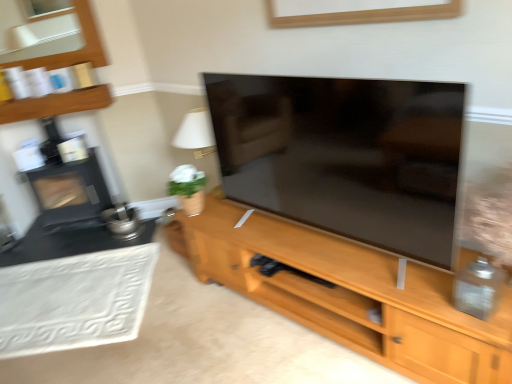
This screenshot has width=512, height=384. Describe the element at coordinates (349, 294) in the screenshot. I see `wooden cabinet at center` at that location.

The width and height of the screenshot is (512, 384). What do you see at coordinates (70, 191) in the screenshot?
I see `black matte fireplace at left` at bounding box center [70, 191].

Identify the location of wooden cabinet at center. The width and height of the screenshot is (512, 384). (349, 294).

Is black matte fireplace at left to the left of wooden shelf at upper left from the viewer's perspective?

Indeed, black matte fireplace at left is positioned on the left side of wooden shelf at upper left.

Is wooden shelf at upper left completely or partially inside black matte fireplace at left?

No, wooden shelf at upper left is not surrounded by black matte fireplace at left.

Is black matte fireplace at left looking in the opposite direction of wooden shelf at upper left?

No, black matte fireplace at left is not facing away from wooden shelf at upper left.

Between black matte fireplace at left and wooden shelf at upper left, which one has more height?

Standing taller between the two is black matte fireplace at left.

Which of these two, wooden shelf at upper left or white textured rug at lower left, is smaller?

Smaller between the two is wooden shelf at upper left.

Considering the sizes of objects wooden shelf at upper left and white textured rug at lower left in the image provided, who is wider, wooden shelf at upper left or white textured rug at lower left?

white textured rug at lower left is wider.

Based on the photo, does wooden shelf at upper left have a lesser height compared to white textured rug at lower left?

No, wooden shelf at upper left is not shorter than white textured rug at lower left.

Is white textured rug at lower left positioned with its back to wooden cabinet at center?

Correct, white textured rug at lower left is looking away from wooden cabinet at center.

Considering the positions of point (151, 262) and point (380, 263), is point (151, 262) closer or farther from the camera than point (380, 263)?

Point (151, 262) is farther from the camera than point (380, 263).

Is white textured rug at lower left to the left or to the right of wooden cabinet at center in the image?

Clearly, white textured rug at lower left is on the left of wooden cabinet at center in the image.

Based on the photo, between white textured rug at lower left and wooden cabinet at center, which one has smaller width?

With smaller width is white textured rug at lower left.

The image size is (512, 384). Find the location of `fireplace above the white textured rug at lower left (from the image's perspective)`. fireplace above the white textured rug at lower left (from the image's perspective) is located at coordinates (70, 191).

Is black matte fireplace at left bigger or smaller than white textured rug at lower left?

In the image, black matte fireplace at left appears to be larger than white textured rug at lower left.

Can you see black matte fireplace at left touching white textured rug at lower left?

There is a gap between black matte fireplace at left and white textured rug at lower left.

Would you say black matte fireplace at left is part of wooden shelf at upper left's contents?

No, wooden shelf at upper left does not contain black matte fireplace at left.

Is wooden shelf at upper left positioned far away from black matte fireplace at left?

No, wooden shelf at upper left is not far from black matte fireplace at left.

How distant is wooden shelf at upper left from black matte fireplace at left?

wooden shelf at upper left and black matte fireplace at left are 26.88 inches apart from each other.

Considering the relative positions of wooden shelf at upper left and black matte fireplace at left in the image provided, is wooden shelf at upper left to the left of black matte fireplace at left from the viewer's perspective?

No.

How far apart are wooden cabinet at center and white textured rug at lower left?

wooden cabinet at center and white textured rug at lower left are 37.25 inches apart.

Is wooden cabinet at center not near white textured rug at lower left?

No, wooden cabinet at center is not far from white textured rug at lower left.

Considering the sizes of objects wooden cabinet at center and white textured rug at lower left in the image provided, who is shorter, wooden cabinet at center or white textured rug at lower left?

white textured rug at lower left is shorter.

Is point (261, 288) farther from viewer compared to point (146, 280)?

That is False.

From the image's perspective, is white textured rug at lower left above wooden shelf at upper left?

No, from the image's perspective, white textured rug at lower left is not over wooden shelf at upper left.

How different are the orientations of white textured rug at lower left and wooden shelf at upper left in degrees?

1.73 degrees.

In the scene shown: Measure the distance between white textured rug at lower left and wooden shelf at upper left.

1.22 meters.

Which object is positioned more to the left, white textured rug at lower left or wooden shelf at upper left?

Positioned to the left is wooden shelf at upper left.

You are a GUI agent. You are given a task and a screenshot of the screen. Output one action in this format:
    pyautogui.click(x=<x>, y=<y>)
    Task: Click on the shelf above the black matte fireplace at left (from the image's perspective)
    The height and width of the screenshot is (384, 512).
    Given the screenshot: What is the action you would take?
    pyautogui.click(x=56, y=104)

You are a GUI agent. You are given a task and a screenshot of the screen. Output one action in this format:
    pyautogui.click(x=<x>, y=<y>)
    Task: Click on the plain on the right side of wooden shelf at upper left
    The image size is (512, 384).
    Given the screenshot: What is the action you would take?
    pyautogui.click(x=75, y=301)

Considering their positions, is wooden cabinet at center positioned closer to white textured rug at lower left than wooden shelf at upper left?

Based on the image, wooden cabinet at center appears to be nearer to white textured rug at lower left.

When comparing their distances from black matte fireplace at left, does white textured rug at lower left or wooden cabinet at center seem closer?

white textured rug at lower left is closer to black matte fireplace at left.

Considering their positions, is white textured rug at lower left positioned further to wooden cabinet at center than wooden shelf at upper left?

Based on the image, wooden shelf at upper left appears to be further to wooden cabinet at center.

From the image, which object appears to be nearer to white textured rug at lower left, black matte fireplace at left or wooden shelf at upper left?

The object closer to white textured rug at lower left is black matte fireplace at left.

Estimate the real-world distances between objects in this image. Which object is closer to wooden shelf at upper left, white textured rug at lower left or black matte fireplace at left?

The object closer to wooden shelf at upper left is black matte fireplace at left.

Looking at this image, estimate the real-world distances between objects in this image. Which object is further from black matte fireplace at left, wooden shelf at upper left or wooden cabinet at center?

wooden cabinet at center.

Estimate the real-world distances between objects in this image. Which object is further from wooden shelf at upper left, black matte fireplace at left or wooden cabinet at center?

wooden cabinet at center is further to wooden shelf at upper left.

Which object lies further to the anchor point white textured rug at lower left, wooden shelf at upper left or wooden cabinet at center?

Among the two, wooden shelf at upper left is located further to white textured rug at lower left.

Image resolution: width=512 pixels, height=384 pixels. What are the coordinates of `plain between wooden cabinet at center and black matte fireplace at left along the z-axis` in the screenshot? It's located at (75, 301).

Identify the location of plain located between wooden cabinet at center and wooden shelf at upper left in the depth direction. (75, 301).

You are a GUI agent. You are given a task and a screenshot of the screen. Output one action in this format:
    pyautogui.click(x=<x>, y=<y>)
    Task: Click on the shelf between wooden cabinet at center and black matte fireplace at left along the z-axis
    The height and width of the screenshot is (384, 512).
    Given the screenshot: What is the action you would take?
    pyautogui.click(x=56, y=104)

The width and height of the screenshot is (512, 384). Identify the location of fireplace between wooden shelf at upper left and white textured rug at lower left in the up-down direction. (70, 191).